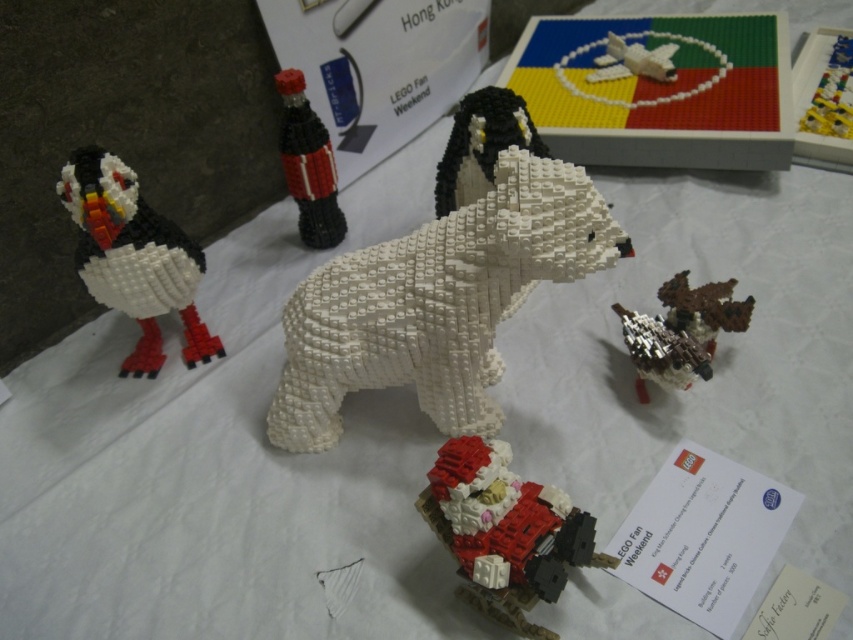
Question: Considering the relative positions of black matte bottle at center and yellow plastic airplane at upper right in the image provided, where is black matte bottle at center located with respect to yellow plastic airplane at upper right?

Choices:
 (A) right
 (B) left

Answer: (B)

Question: Considering the real-world distances, which object is farthest from the black matte penguin at center?

Choices:
 (A) white matte polar bear at center
 (B) black matte bottle at center
 (C) yellow plastic airplane at upper right
 (D) brown matte bird at center-right

Answer: (C)

Question: Which point is farther from the camera taking this photo?

Choices:
 (A) (517, 276)
 (B) (636, 342)
 (C) (844, 76)
 (D) (444, 177)

Answer: (C)

Question: Is the position of white matte polar bear at center less distant than that of matte red santa at lower center?

Choices:
 (A) no
 (B) yes

Answer: (A)

Question: Does matte red santa at lower center appear under black matte penguin at center?

Choices:
 (A) yes
 (B) no

Answer: (A)

Question: Which of the following is the closest to the observer?

Choices:
 (A) metallic silver bird at center-right
 (B) white matte airplane at upper center
 (C) brick-patterned bird at left

Answer: (C)